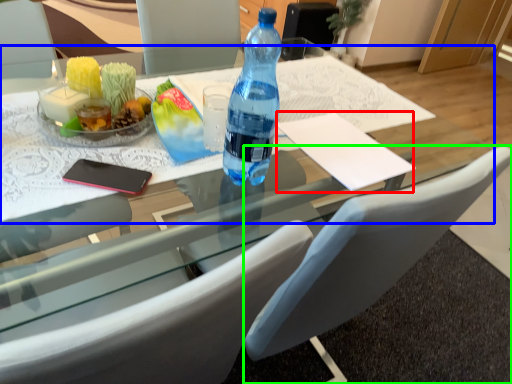
Question: Which is nearer to the notepad (highlighted by a red box)? round table (highlighted by a blue box) or chair (highlighted by a green box).

Choices:
 (A) round table
 (B) chair

Answer: (A)